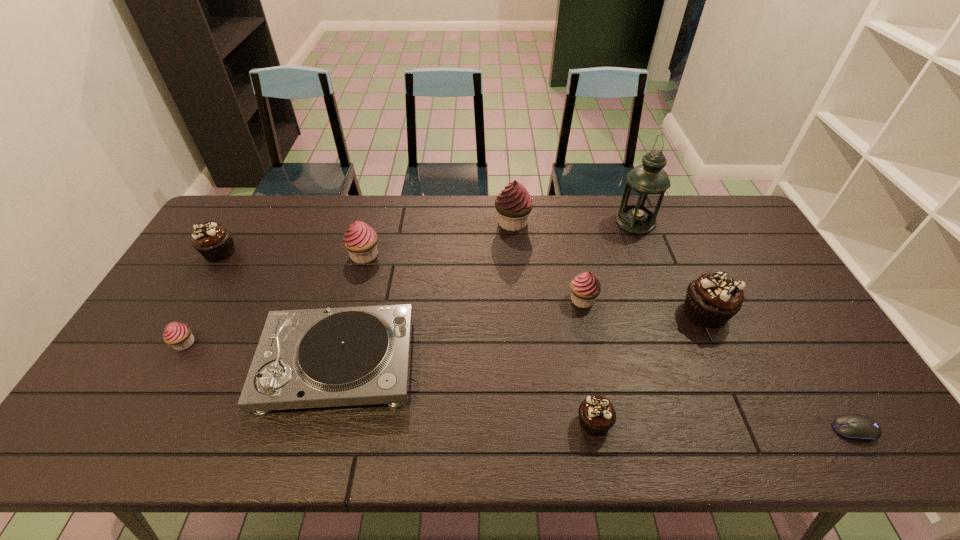
Where is `free location at the far right corner`? The image size is (960, 540). free location at the far right corner is located at coordinates (727, 222).

The image size is (960, 540). Find the location of `blank region between the farthest brown cupcake and the oil lamp`. blank region between the farthest brown cupcake and the oil lamp is located at coordinates (427, 237).

Locate an element on the screen. This screenshot has width=960, height=540. vacant point located between the record player and the tallest cupcake is located at coordinates (425, 293).

Identify the location of vacant area that lies between the rightmost cupcake and the nearest brown cupcake. [649, 367].

This screenshot has width=960, height=540. What are the coordinates of `vacant area between the tallest object and the record player` in the screenshot? It's located at (487, 292).

Identify the location of vacant point located between the second brown cupcake from left to right and the rightmost cupcake. (649, 367).

Find the location of a particular element. This screenshot has height=540, width=960. vacant space that is in between the second farthest pink cupcake and the second nearest pink cupcake is located at coordinates (473, 278).

Identify the location of free space between the smallest brown cupcake and the record player. (466, 393).

Identify the location of object that can be found as the seventh closest to the smallest brown cupcake. This screenshot has width=960, height=540. (360, 240).

Locate an element on the screen. object that stands as the eighth closest to the second biggest pink cupcake is located at coordinates (713, 299).